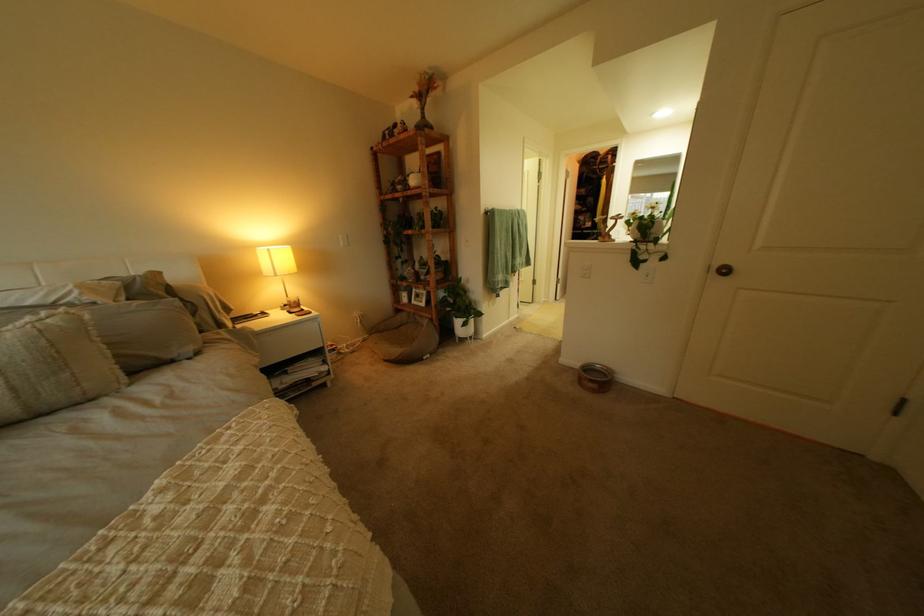
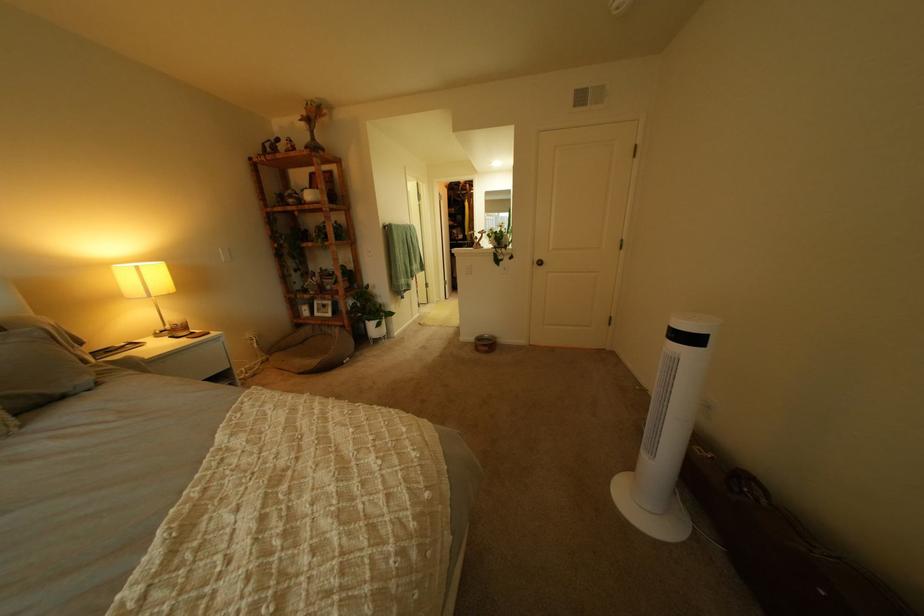
Where in the second image is the point corresponding to point 593,367 from the first image?

(489, 339)